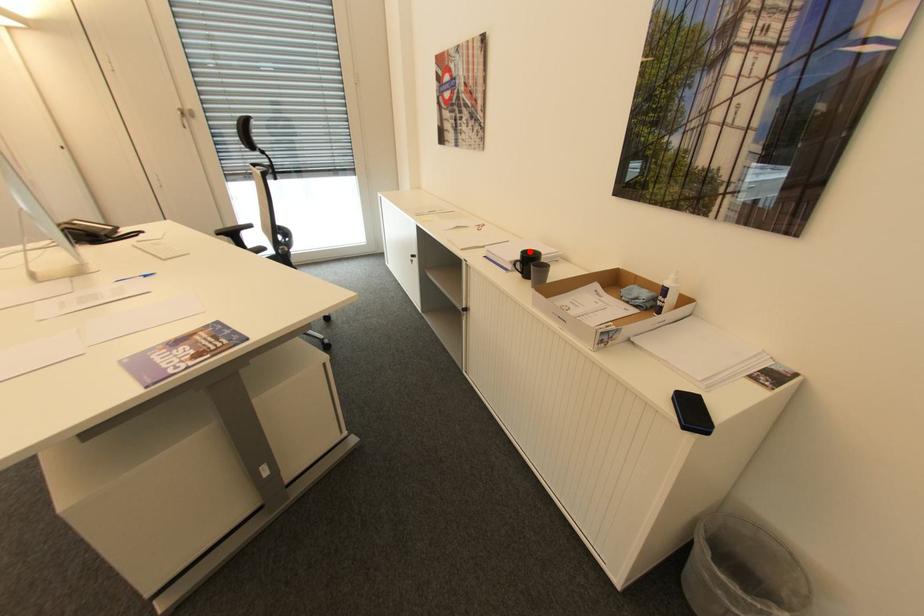
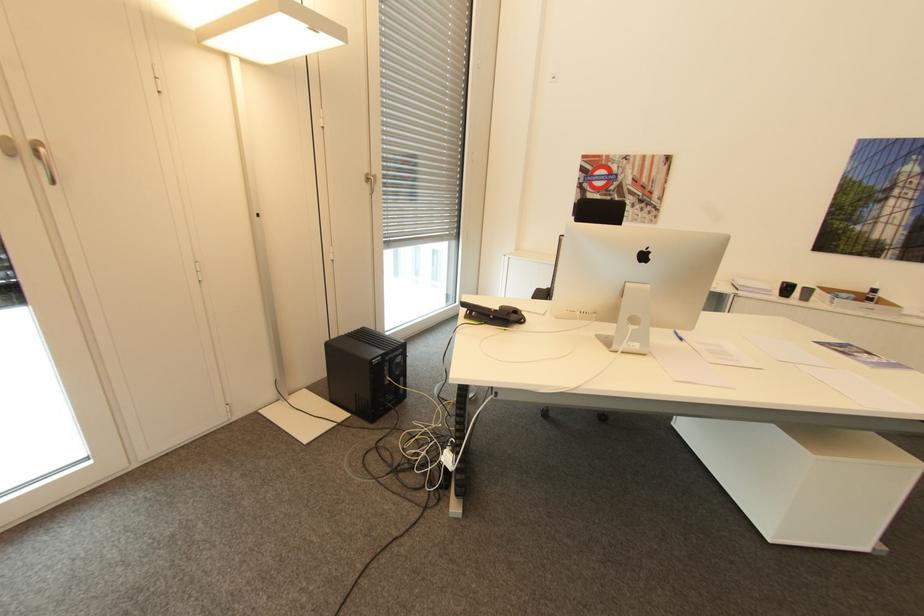
Locate, in the second image, the point that corresponds to the highlighted location in the first image.

(788, 283)